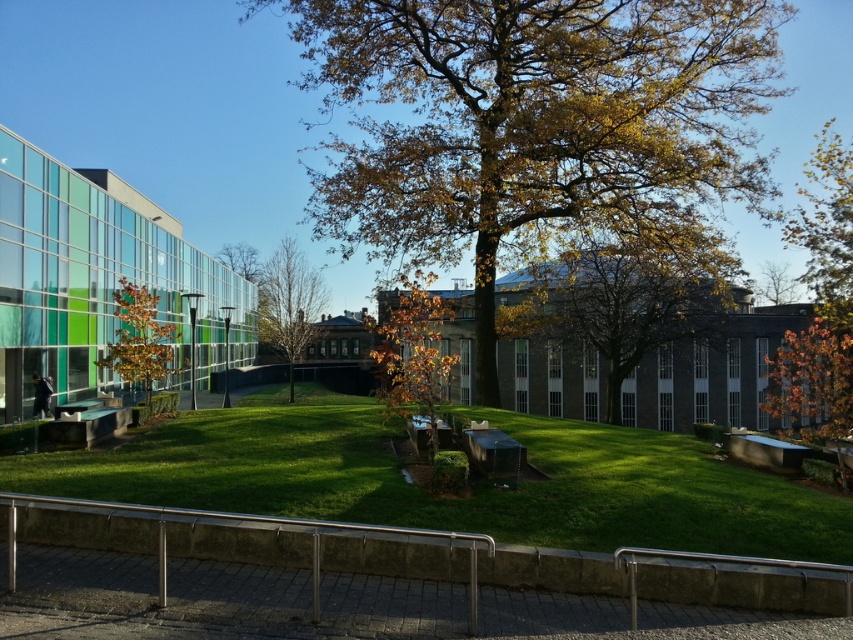
Question: Which object appears farthest from the camera in this image?

Choices:
 (A) green grassy at center
 (B) bare branches at center

Answer: (B)

Question: Among these points, which one is nearest to the camera?

Choices:
 (A) (769, 298)
 (B) (741, 486)

Answer: (B)

Question: Is green grassy at center smaller than orange leafy tree at right?

Choices:
 (A) yes
 (B) no

Answer: (A)

Question: Which object is farther from the camera taking this photo?

Choices:
 (A) green leafy tree at center
 (B) golden leafy tree at center

Answer: (A)

Question: Is green leafy tree at left below metallic silver bench at lower left?

Choices:
 (A) no
 (B) yes

Answer: (A)

Question: Is orange leafy tree at right to the left of golden leafy tree at center from the viewer's perspective?

Choices:
 (A) no
 (B) yes

Answer: (A)